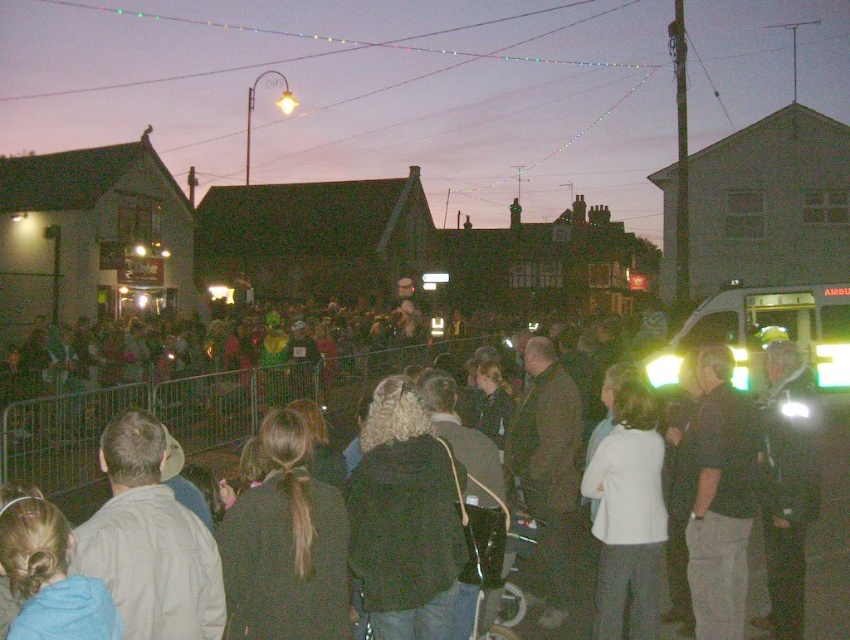
Does dark gray clothing at center come in front of white matte jacket at center?

Yes, dark gray clothing at center is closer to the viewer.

Who is more distant from viewer, (247, 388) or (647, 563)?

Positioned behind is point (247, 388).

Where is `dark gray clothing at center`? This screenshot has width=850, height=640. dark gray clothing at center is located at coordinates (188, 413).